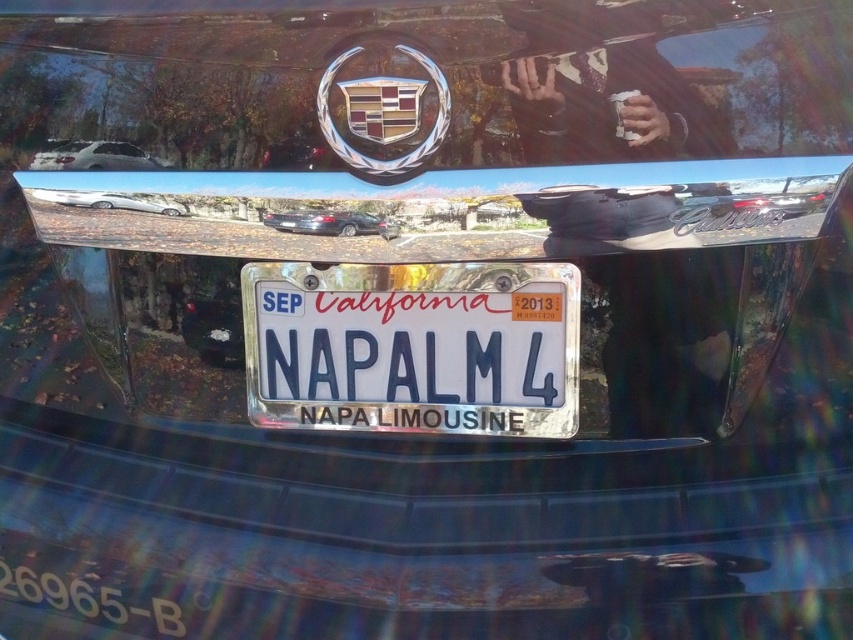
You are a photographer trying to capture both the white glossy sedan at upper left and the shiny black sedan at center in a single frame. Which car should you focus on first to ensure both fit in the shot?

The white glossy sedan at upper left is larger in size than the shiny black sedan at center, so you should focus on the white glossy sedan at upper left first to ensure both cars fit in the shot.

You are standing 5 feet away from a black Cadillac vehicle. The license plate has a point at coordinates point [381,227]. Is this point closer to you than the rest of the license plate?

The distance of point [381,227] from camera is 4.12 feet, so yes, the point is closer to you than the rest of the license plate since you are standing 5 feet away.